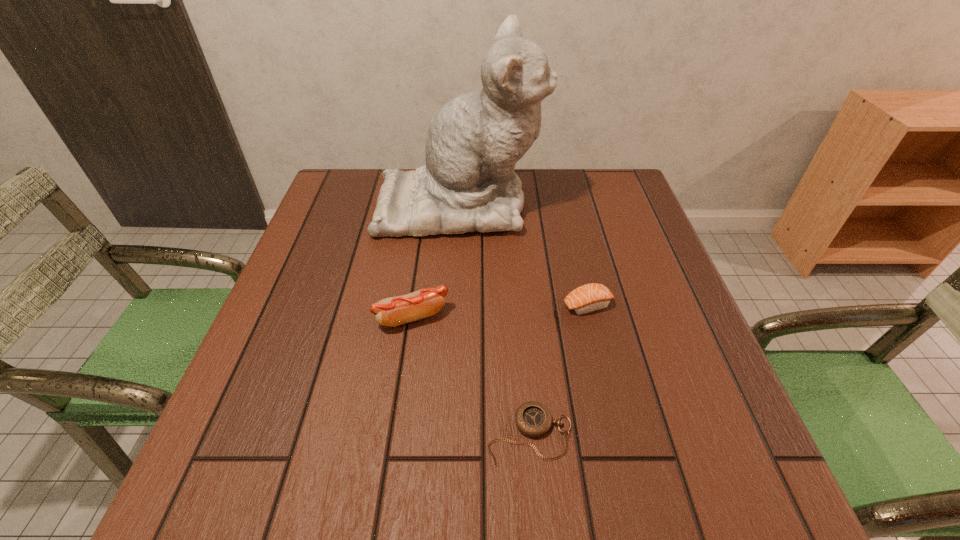
Identify the location of vacant space at the far left corner of the desktop. (358, 198).

Locate an element on the screen. The width and height of the screenshot is (960, 540). vacant space at the far right corner of the desktop is located at coordinates (592, 187).

I want to click on vacant area at the near right corner, so click(702, 481).

Identify the location of vacant space in between the farthest object and the third shortest object. The width and height of the screenshot is (960, 540). click(436, 260).

Find the location of a particular element. This screenshot has width=960, height=540. unoccupied area between the rightmost object and the sausage is located at coordinates (500, 311).

Locate an element on the screen. The height and width of the screenshot is (540, 960). empty space between the second shortest object and the shortest object is located at coordinates (559, 370).

Where is `vacant region between the second shortest object and the cat`? The height and width of the screenshot is (540, 960). vacant region between the second shortest object and the cat is located at coordinates (523, 254).

Locate an element on the screen. vacant area that lies between the sushi and the sausage is located at coordinates (500, 311).

Where is `free spot between the sausage and the cat`? free spot between the sausage and the cat is located at coordinates (436, 260).

Locate an element on the screen. The width and height of the screenshot is (960, 540). free spot between the sushi and the sausage is located at coordinates (500, 311).